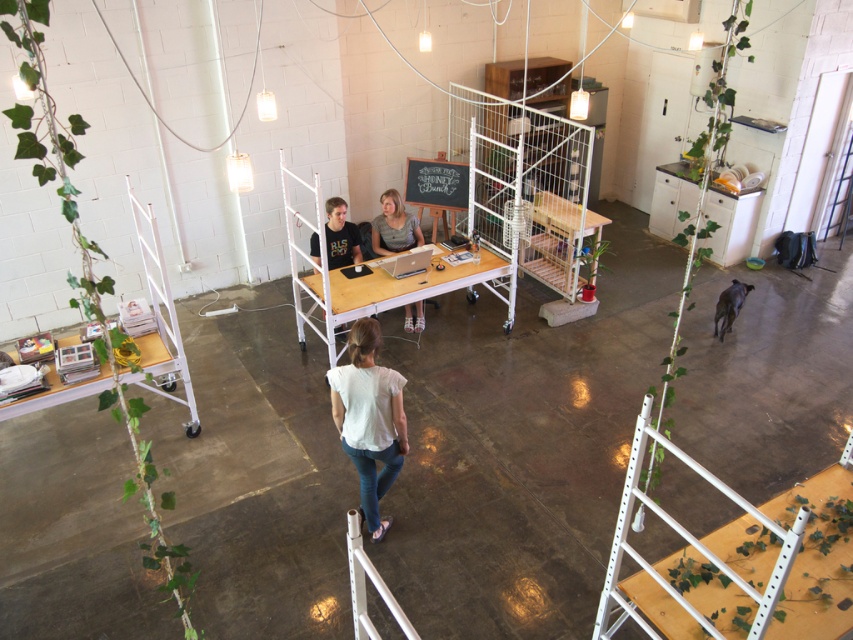
You are a photographer setting up a shoot in this workspace. You need to ensure that the white cotton shirt at center and the matte black laptop at center are both visible in the frame. Given their sizes, which object will require more space in the composition?

The white cotton shirt at center is larger in size than the matte black laptop at center, so it will require more space in the composition.

You are a delivery person who needs to place a package between the white cotton shirt at center and the matte black laptop at center. The package is 10 feet long. Will the package fit in the space between them?

The distance between the white cotton shirt at center and the matte black laptop at center is 8.77 feet. Since the package is 10 feet long, which is longer than the available space, it will not fit between them.